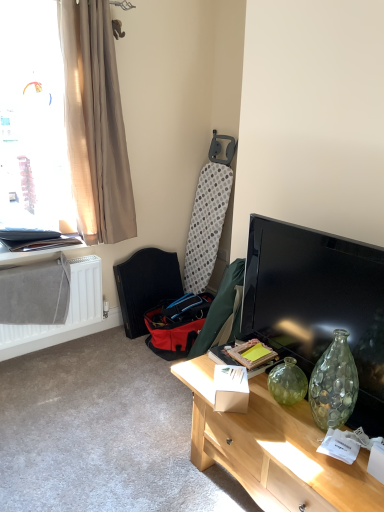
This screenshot has width=384, height=512. In order to click on translucent beige curtain at upper left in this screenshot , I will do `click(33, 120)`.

What is the approximate height of red fabric swivel chair at lower left?

It is 72.05 centimeters.

This screenshot has width=384, height=512. Describe the element at coordinates (36, 250) in the screenshot. I see `metallic silver frame at left` at that location.

I want to click on beige fabric curtain at left, so click(95, 123).

This screenshot has width=384, height=512. What do you see at coordinates (67, 314) in the screenshot? I see `white matte radiator at lower left` at bounding box center [67, 314].

Image resolution: width=384 pixels, height=512 pixels. I want to click on black glossy tv at right, so click(x=318, y=303).

Find the location of a particular element. Image resolution: width=384 pixels, height=512 pixels. translucent beige curtain at upper left is located at coordinates (33, 120).

Does beige fabric curtain at left have a lesser height compared to red fabric swivel chair at lower left?

No.

Is beige fabric curtain at left positioned beyond the bounds of red fabric swivel chair at lower left?

Absolutely, beige fabric curtain at left is external to red fabric swivel chair at lower left.

At what (x,y) coordinates should I click in order to perform the action: click on swivel chair located below the beige fabric curtain at left (from the image's perspective). Please return your answer as a coordinate pair (x, y). This screenshot has width=384, height=512. Looking at the image, I should click on (146, 286).

Is beige fabric curtain at left positioned behind red fabric swivel chair at lower left?

No, beige fabric curtain at left is closer to the viewer.

Is translucent glass vase at center right positioned far away from white matte radiator at lower left?

Yes, translucent glass vase at center right is far from white matte radiator at lower left.

You are a GUI agent. You are given a task and a screenshot of the screen. Output one action in this format:
    pyautogui.click(x=<x>, y=<y>)
    Task: Click on the desk in front of the white matte radiator at lower left
    The image size is (384, 512).
    Given the screenshot: What is the action you would take?
    pyautogui.click(x=273, y=449)

From the image's perspective, is translucent glass vase at center right under white matte radiator at lower left?

Correct, translucent glass vase at center right appears lower than white matte radiator at lower left in the image.

Would you say translucent glass vase at center right is inside or outside white matte radiator at lower left?

translucent glass vase at center right is spatially situated outside white matte radiator at lower left.

How different are the orientations of translucent glass vase at center right and red fabric swivel chair at lower left in degrees?

88.6 degrees separate the facing orientations of translucent glass vase at center right and red fabric swivel chair at lower left.

From a real-world perspective, is translucent glass vase at center right physically above red fabric swivel chair at lower left?

No, from a real-world perspective, translucent glass vase at center right is not above red fabric swivel chair at lower left.

Would you consider translucent glass vase at center right to be distant from red fabric swivel chair at lower left?

Yes, translucent glass vase at center right and red fabric swivel chair at lower left are located far from each other.

Find the location of a particular element. The width and height of the screenshot is (384, 512). swivel chair behind the translucent glass vase at center right is located at coordinates (146, 286).

Consider the image. Would you consider beige fabric curtain at left to be distant from translucent glass vase at center right?

Yes, beige fabric curtain at left and translucent glass vase at center right are quite far apart.

The image size is (384, 512). What are the coordinates of `curtain located above the translucent glass vase at center right (from a real-world perspective)` in the screenshot? It's located at (95, 123).

Who is taller, beige fabric curtain at left or translucent glass vase at center right?

With more height is beige fabric curtain at left.

From the image's perspective, is beige fabric curtain at left positioned above or below translucent glass vase at center right?

beige fabric curtain at left is above translucent glass vase at center right.

Which of these two, white matte radiator at lower left or translucent glass vase at center right, stands taller?

With more height is white matte radiator at lower left.

Is white matte radiator at lower left outside of translucent glass vase at center right?

white matte radiator at lower left is positioned outside translucent glass vase at center right.

Is the depth of white matte radiator at lower left greater than that of translucent glass vase at center right?

Yes, it is.

Consider the image. Can we say black glossy tv at right lies outside metallic silver frame at left?

Yes, black glossy tv at right is located beyond the bounds of metallic silver frame at left.

Is black glossy tv at right facing towards metallic silver frame at left?

No, black glossy tv at right is not turned towards metallic silver frame at left.

From the image's perspective, does black glossy tv at right appear higher than metallic silver frame at left?

No.

Is point (365, 268) farther from viewer compared to point (51, 251)?

No, (365, 268) is in front of (51, 251).

Could you tell me if beige fabric curtain at left is turned towards black glossy tv at right?

Yes, beige fabric curtain at left is oriented towards black glossy tv at right.

In the scene shown: Is beige fabric curtain at left surrounding black glossy tv at right?

No, black glossy tv at right is located outside of beige fabric curtain at left.

Can you confirm if beige fabric curtain at left is positioned to the right of black glossy tv at right?

Incorrect, beige fabric curtain at left is not on the right side of black glossy tv at right.

Between beige fabric curtain at left and black glossy tv at right, which one has larger width?

beige fabric curtain at left.

You are a GUI agent. You are given a task and a screenshot of the screen. Output one action in this format:
    pyautogui.click(x=<x>, y=<y>)
    Task: Click on the curtain that appears on the left of red fabric swivel chair at lower left
    The width and height of the screenshot is (384, 512).
    Given the screenshot: What is the action you would take?
    pyautogui.click(x=95, y=123)

Image resolution: width=384 pixels, height=512 pixels. In order to click on radiator lying above the translucent glass vase at center right (from the image's perspective) in this screenshot , I will do `click(67, 314)`.

When comparing their distances from metallic silver frame at left, does black glossy tv at right or white matte radiator at lower left seem closer?

white matte radiator at lower left is closer to metallic silver frame at left.

Based on their spatial positions, is black glossy tv at right or metallic silver frame at left further from red fabric swivel chair at lower left?

black glossy tv at right is further to red fabric swivel chair at lower left.

Estimate the real-world distances between objects in this image. Which object is further from beige fabric curtain at left, black glossy tv at right or translucent beige curtain at upper left?

black glossy tv at right is further to beige fabric curtain at left.

Which object lies nearer to the anchor point translucent beige curtain at upper left, metallic silver frame at left or black glossy tv at right?

Based on the image, metallic silver frame at left appears to be nearer to translucent beige curtain at upper left.

Estimate the real-world distances between objects in this image. Which object is closer to beige fabric curtain at left, translucent glass vase at center right or white matte radiator at lower left?

white matte radiator at lower left is closer to beige fabric curtain at left.

Based on their spatial positions, is white matte radiator at lower left or metallic silver frame at left further from beige fabric curtain at left?

A: The object further to beige fabric curtain at left is white matte radiator at lower left.

Looking at the image, which one is located closer to beige fabric curtain at left, white matte radiator at lower left or translucent glass vase at center right?

The object closer to beige fabric curtain at left is white matte radiator at lower left.

Considering their positions, is translucent glass vase at center right positioned further to beige fabric curtain at left than black glossy tv at right?

translucent glass vase at center right.

Identify the location of swivel chair between beige fabric curtain at left and white matte radiator at lower left vertically. The height and width of the screenshot is (512, 384). (146, 286).

Identify the location of curtain between metallic silver frame at left and black glossy tv at right in the horizontal direction. (95, 123).

You are a GUI agent. You are given a task and a screenshot of the screen. Output one action in this format:
    pyautogui.click(x=<x>, y=<y>)
    Task: Click on the window sill between beige fabric curtain at left and white matte radiator at lower left from top to bottom
    The height and width of the screenshot is (512, 384).
    Given the screenshot: What is the action you would take?
    pyautogui.click(x=36, y=250)

Where is `window screen between beige fabric curtain at left and white matte radiator at lower left in the up-down direction`? window screen between beige fabric curtain at left and white matte radiator at lower left in the up-down direction is located at coordinates click(x=33, y=120).